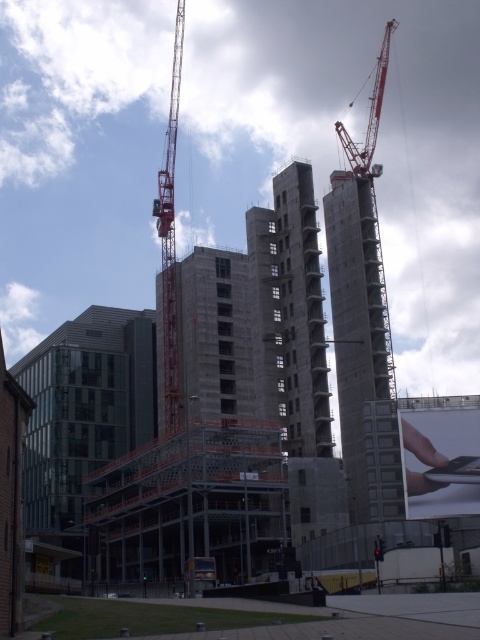
Between concrete tower at center and concrete/cement crane at upper right, which one is positioned lower?

concrete tower at center

Is concrete tower at center to the left of concrete/cement crane at upper right from the viewer's perspective?

Correct, you'll find concrete tower at center to the left of concrete/cement crane at upper right.

Between point (354, 282) and point (380, 291), which one is positioned in front?

Positioned in front is point (380, 291).

Locate an element on the screen. This screenshot has height=640, width=480. concrete tower at center is located at coordinates (361, 346).

Is red metal crane at center smaller than concrete/cement crane at upper right?

Correct, red metal crane at center occupies less space than concrete/cement crane at upper right.

Based on the photo, is red metal crane at center to the left of concrete/cement crane at upper right from the viewer's perspective?

Yes, red metal crane at center is to the left of concrete/cement crane at upper right.

Image resolution: width=480 pixels, height=640 pixels. What do you see at coordinates (169, 241) in the screenshot? I see `red metal crane at center` at bounding box center [169, 241].

Locate an element on the screen. The height and width of the screenshot is (640, 480). red metal crane at center is located at coordinates (169, 241).

From the picture: Can you confirm if concrete tower at center is bigger than red metal crane at center?

Actually, concrete tower at center might be smaller than red metal crane at center.

What do you see at coordinates (361, 346) in the screenshot? This screenshot has width=480, height=640. I see `concrete tower at center` at bounding box center [361, 346].

Locate an element on the screen. Image resolution: width=480 pixels, height=640 pixels. concrete tower at center is located at coordinates coord(361,346).